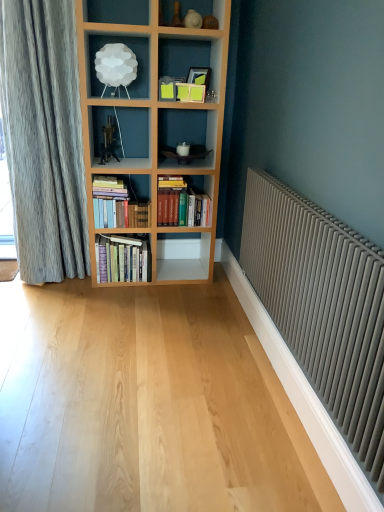
Image resolution: width=384 pixels, height=512 pixels. What do you see at coordinates (117, 205) in the screenshot? I see `hardcover books at center, which is counted as the 2th book, starting from the right` at bounding box center [117, 205].

Measure the distance between hardcover books at center, which is counted as the 2th book, starting from the right, and camera.

hardcover books at center, which is counted as the 2th book, starting from the right, and camera are 9.28 feet apart.

What do you see at coordinates (122, 259) in the screenshot?
I see `hardcover books at center, which ranks as the first book in left-to-right order` at bounding box center [122, 259].

What do you see at coordinates (136, 57) in the screenshot? I see `white cloud lamp at upper center` at bounding box center [136, 57].

The image size is (384, 512). Find the location of `hardcover books at center, which is the first book in right-to-left order`. hardcover books at center, which is the first book in right-to-left order is located at coordinates (182, 204).

Describe the element at coordinates (322, 307) in the screenshot. I see `matte gray radiator at right` at that location.

What is the approximate height of matte gray radiator at right?

matte gray radiator at right is 28.21 inches in height.

The image size is (384, 512). Find the location of `hardcover books at center, which is counted as the 2th book, starting from the right`. hardcover books at center, which is counted as the 2th book, starting from the right is located at coordinates (117, 205).

How distant is white cloud lamp at upper center from hardcover books at center, positioned as the third book in left-to-right order?

white cloud lamp at upper center is 31.18 inches away from hardcover books at center, positioned as the third book in left-to-right order.

Who is bigger, white cloud lamp at upper center or hardcover books at center, positioned as the third book in left-to-right order?

With larger size is hardcover books at center, positioned as the third book in left-to-right order.

From the image's perspective, does white cloud lamp at upper center appear higher than hardcover books at center, which is the first book in right-to-left order?

Correct, white cloud lamp at upper center appears higher than hardcover books at center, which is the first book in right-to-left order, in the image.

From a real-world perspective, is hardcover books at center, which ranks as the first book in left-to-right order, over hardcover books at center, the 2th book from the left?

No.

Considering the points (129, 281) and (109, 176), which point is behind, point (129, 281) or point (109, 176)?

Point (109, 176)

From the image's perspective, would you say hardcover books at center, which ranks as the first book in left-to-right order, is shown under hardcover books at center, the 2th book from the left?

Indeed, from the image's perspective, hardcover books at center, which ranks as the first book in left-to-right order, is shown beneath hardcover books at center, the 2th book from the left.

Are hardcover books at center, which ranks as the first book in left-to-right order, and hardcover books at center, the 2th book from the left, beside each other?

They are not placed beside each other.

Is hardcover books at center, positioned as the third book in left-to-right order, to the right of matte gray radiator at right from the viewer's perspective?

Incorrect, hardcover books at center, positioned as the third book in left-to-right order, is not on the right side of matte gray radiator at right.

I want to click on the 2nd book behind the matte gray radiator at right, starting your count from the anchor, so click(182, 204).

Is hardcover books at center, positioned as the third book in left-to-right order, bigger than matte gray radiator at right?

No, hardcover books at center, positioned as the third book in left-to-right order, is not bigger than matte gray radiator at right.

Is the depth of hardcover books at center, positioned as the third book in left-to-right order, less than that of matte gray radiator at right?

No, hardcover books at center, positioned as the third book in left-to-right order, is further to the viewer.

Which is less distant, (337, 335) or (177, 188)?

The point (337, 335) is in front.

Is hardcover books at center, positioned as the third book in left-to-right order, at the back of matte gray radiator at right?

matte gray radiator at right does not have its back to hardcover books at center, positioned as the third book in left-to-right order.

Between matte gray radiator at right and hardcover books at center, positioned as the third book in left-to-right order, which one is positioned in front?

Positioned in front is matte gray radiator at right.

Is matte gray radiator at right next to hardcover books at center, positioned as the third book in left-to-right order, and touching it?

No, matte gray radiator at right is not next to hardcover books at center, positioned as the third book in left-to-right order.

Is hardcover books at center, the 2th book from the left, inside the boundaries of hardcover books at center, positioned as the third book in left-to-right order, or outside?

hardcover books at center, the 2th book from the left, is not inside hardcover books at center, positioned as the third book in left-to-right order, it's outside.

This screenshot has width=384, height=512. What are the coordinates of `book to the right of hardcover books at center, which is counted as the 2th book, starting from the right` in the screenshot? It's located at (182, 204).

Is point (108, 179) closer or farther from the camera than point (182, 199)?

Point (108, 179) is positioned farther from the camera compared to point (182, 199).

Is hardcover books at center, which is counted as the 2th book, starting from the right, not near hardcover books at center, positioned as the third book in left-to-right order?

That's not correct — hardcover books at center, which is counted as the 2th book, starting from the right, is a little close to hardcover books at center, positioned as the third book in left-to-right order.

Based on the photo, is the position of white cloud lamp at upper center more distant than that of hardcover books at center, which is counted as the 2th book, starting from the right?

No, white cloud lamp at upper center is in front of hardcover books at center, which is counted as the 2th book, starting from the right.

Is white cloud lamp at upper center with hardcover books at center, the 2th book from the left?

No.

From the white cloud lamp at upper center, count 1st books backward and point to it. Please provide its 2D coordinates.

[(117, 205)]

Can you confirm if white cloud lamp at upper center is taller than hardcover books at center, the 2th book from the left?

Incorrect, the height of white cloud lamp at upper center is not larger of that of hardcover books at center, the 2th book from the left.

Can you confirm if hardcover books at center, which is the first book in right-to-left order, is shorter than hardcover books at center, the 2th book from the left?

Incorrect, the height of hardcover books at center, which is the first book in right-to-left order, does not fall short of that of hardcover books at center, the 2th book from the left.

Is hardcover books at center, positioned as the third book in left-to-right order, aimed at hardcover books at center, the 2th book from the left?

No.

Does point (161, 211) come behind point (102, 212)?

Yes.

Where is `the 2nd book behind the white cloud lamp at upper center, starting your count from the anchor`? the 2nd book behind the white cloud lamp at upper center, starting your count from the anchor is located at coordinates (182, 204).

The image size is (384, 512). In order to click on the 1st book above the hardcover books at center, the third book positioned from the right (from the image's perspective) in this screenshot , I will do `click(117, 205)`.

Which object lies further to the anchor point white cloud lamp at upper center, hardcover books at center, the 2th book from the left, or hardcover books at center, which ranks as the first book in left-to-right order?

hardcover books at center, which ranks as the first book in left-to-right order, is positioned further to the anchor white cloud lamp at upper center.

Which object lies nearer to the anchor point hardcover books at center, which ranks as the first book in left-to-right order, hardcover books at center, which is counted as the 2th book, starting from the right, or matte gray radiator at right?

Among the two, hardcover books at center, which is counted as the 2th book, starting from the right, is located nearer to hardcover books at center, which ranks as the first book in left-to-right order.

From the image, which object appears to be farther from hardcover books at center, which ranks as the first book in left-to-right order, matte gray radiator at right or hardcover books at center, which is counted as the 2th book, starting from the right?

matte gray radiator at right.

Estimate the real-world distances between objects in this image. Which object is closer to hardcover books at center, which is counted as the 2th book, starting from the right, hardcover books at center, the third book positioned from the right, or matte gray radiator at right?

hardcover books at center, the third book positioned from the right, lies closer to hardcover books at center, which is counted as the 2th book, starting from the right, than the other object.

When comparing their distances from hardcover books at center, positioned as the third book in left-to-right order, does matte gray radiator at right or hardcover books at center, which is counted as the 2th book, starting from the right, seem closer?

hardcover books at center, which is counted as the 2th book, starting from the right, is positioned closer to the anchor hardcover books at center, positioned as the third book in left-to-right order.

From the image, which object appears to be farther from hardcover books at center, positioned as the third book in left-to-right order, hardcover books at center, which ranks as the first book in left-to-right order, or hardcover books at center, the 2th book from the left?

hardcover books at center, which ranks as the first book in left-to-right order, lies further to hardcover books at center, positioned as the third book in left-to-right order, than the other object.

Based on the photo, looking at the image, which one is located further to hardcover books at center, which ranks as the first book in left-to-right order, hardcover books at center, the 2th book from the left, or hardcover books at center, positioned as the third book in left-to-right order?

hardcover books at center, positioned as the third book in left-to-right order.

From the image, which object appears to be farther from hardcover books at center, which ranks as the first book in left-to-right order, hardcover books at center, which is the first book in right-to-left order, or white cloud lamp at upper center?

The object further to hardcover books at center, which ranks as the first book in left-to-right order, is white cloud lamp at upper center.

You are a GUI agent. You are given a task and a screenshot of the screen. Output one action in this format:
    pyautogui.click(x=<x>, y=<y>)
    Task: Click on the shelf located between matte gray radiator at right and hardcover books at center, which is counted as the 2th book, starting from the right, in the depth direction
    This screenshot has height=512, width=384.
    Given the screenshot: What is the action you would take?
    point(136,57)

This screenshot has width=384, height=512. Find the location of `book that lies between white cloud lamp at upper center and hardcover books at center, which is counted as the 2th book, starting from the right, from top to bottom`. book that lies between white cloud lamp at upper center and hardcover books at center, which is counted as the 2th book, starting from the right, from top to bottom is located at coordinates (182, 204).

Identify the location of book located between hardcover books at center, which ranks as the first book in left-to-right order, and hardcover books at center, which is the first book in right-to-left order, in the left-right direction. (117, 205).

Image resolution: width=384 pixels, height=512 pixels. In order to click on shelf between matte gray radiator at right and hardcover books at center, positioned as the third book in left-to-right order, from front to back in this screenshot , I will do click(136, 57).